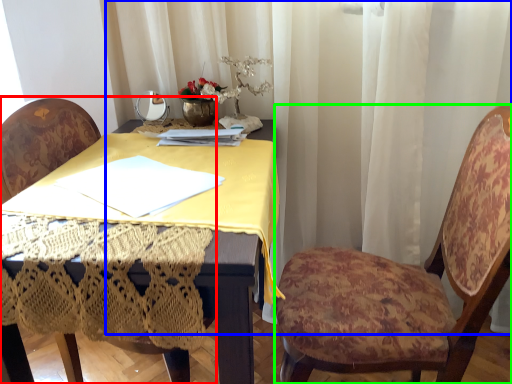
Question: Which object is positioned closest to chair (highlighted by a red box)? Select from curtain (highlighted by a blue box) and chair (highlighted by a green box).

Choices:
 (A) curtain
 (B) chair

Answer: (A)